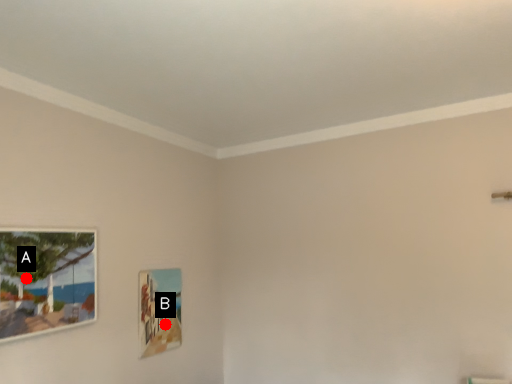
Question: Two points are circled on the image, labeled by A and B beside each circle. Which point is farther to the camera?

Choices:
 (A) A is further
 (B) B is further

Answer: (B)